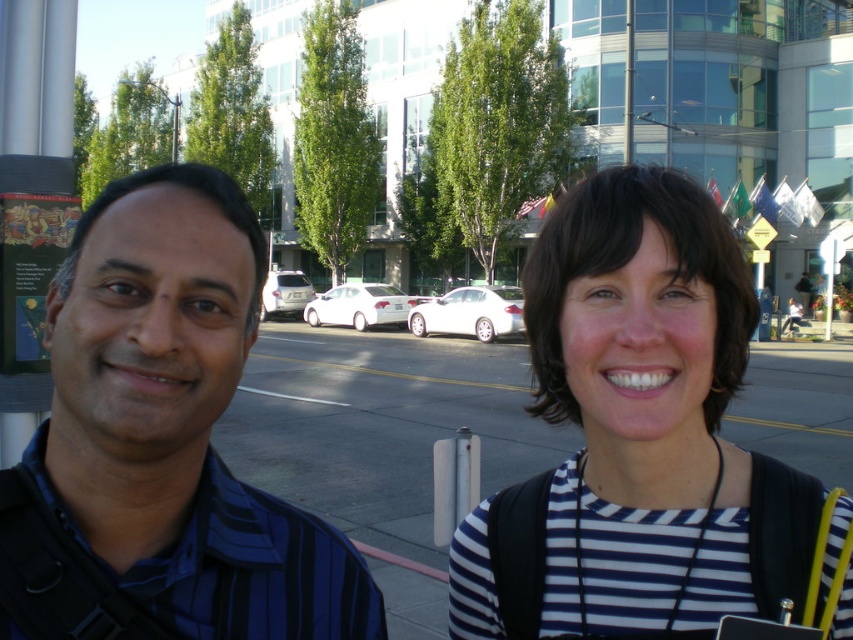
From the picture: You are trying to decide which person to approach for a conversation. The white striped shirt at center and the blue striped shirt at left are both facing you. Based on their positions, which one is physically closer to you?

The white striped shirt at center is wider than the blue striped shirt at left, but this information doesn not indicate their distance from you. Without additional details about their positions, it is impossible to determine which is closer.